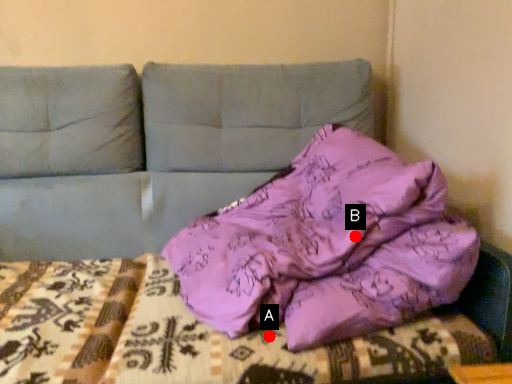
Question: Two points are circled on the image, labeled by A and B beside each circle. Which point is closer to the camera taking this photo?

Choices:
 (A) A is closer
 (B) B is closer

Answer: (A)